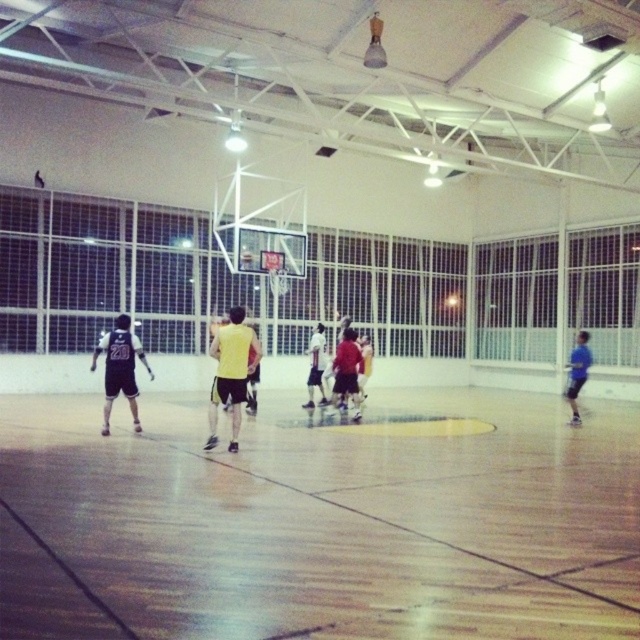
Question: Which point is closer to the camera?

Choices:
 (A) (340, 346)
 (B) (573, 396)
 (C) (115, 364)
 (D) (131, 371)

Answer: (C)

Question: Considering the relative positions of matte black jersey at left and matte red jersey at center in the image provided, where is matte black jersey at left located with respect to matte red jersey at center?

Choices:
 (A) right
 (B) left

Answer: (B)

Question: Is yellow matte basketball at center positioned before matte red jersey at center?

Choices:
 (A) no
 (B) yes

Answer: (A)

Question: Which of these objects is positioned closest to the yellow matte basketball player at center?

Choices:
 (A) matte black jersey at left
 (B) matte red jersey at center
 (C) wooden at center
 (D) yellow matte basketball at center

Answer: (A)

Question: Among these objects, which one is nearest to the camera?

Choices:
 (A) matte black jersey at left
 (B) matte red jersey at center
 (C) wooden at center

Answer: (C)

Question: In this image, where is yellow matte basketball at center located relative to blue matte shirt at right?

Choices:
 (A) below
 (B) above

Answer: (A)